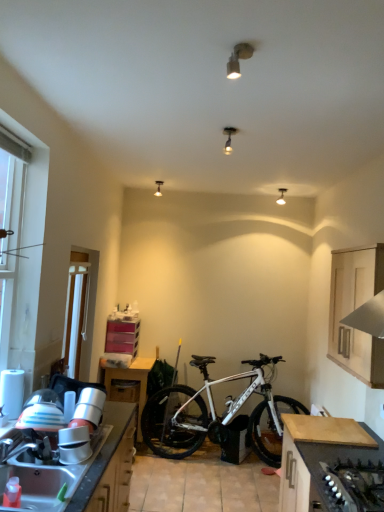
Where is `free spot in front of white matte bicycle at center`? free spot in front of white matte bicycle at center is located at coordinates (222, 484).